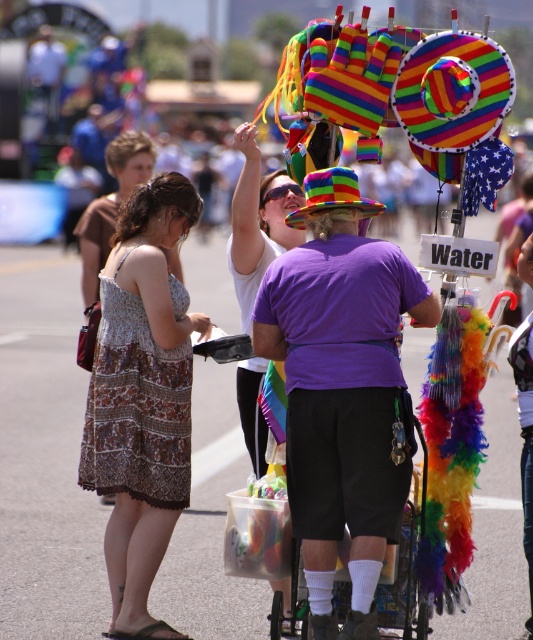
Which of these two, purple cotton shirt at center or multicolored feathered cart at center, stands taller?

Standing taller between the two is purple cotton shirt at center.

Between point (414, 316) and point (276, 596), which one is positioned behind?

Point (276, 596)

I want to click on purple cotton shirt at center, so click(x=341, y=388).

In the scene shown: Between printed fabric dress at center and matte white shirt at center, which one appears on the left side from the viewer's perspective?

Positioned to the left is printed fabric dress at center.

Does printed fabric dress at center have a lesser height compared to matte white shirt at center?

Yes.

Is point (104, 464) farther from viewer compared to point (271, 188)?

No, (104, 464) is closer to viewer.

What are the coordinates of `printed fabric dress at center` in the screenshot? It's located at [x=142, y=397].

Consider the image. Which is above, purple cotton shirt at center or printed fabric dress at center?

Positioned higher is purple cotton shirt at center.

Does purple cotton shirt at center have a greater height compared to printed fabric dress at center?

Incorrect, purple cotton shirt at center's height is not larger of printed fabric dress at center's.

Is point (354, 198) farther from camera compared to point (124, 449)?

No.

This screenshot has height=640, width=533. Find the location of `purple cotton shirt at center`. purple cotton shirt at center is located at coordinates (341, 388).